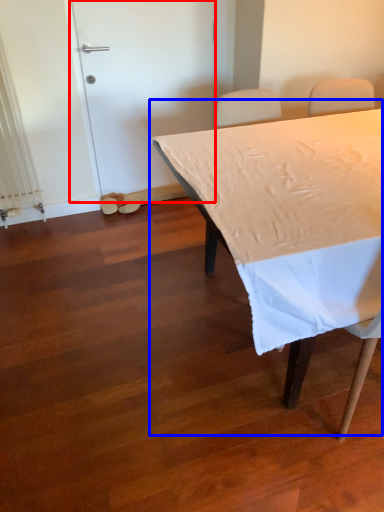
Question: Among these objects, which one is nearest to the camera, door (highlighted by a red box) or table (highlighted by a blue box)?

Choices:
 (A) door
 (B) table

Answer: (B)